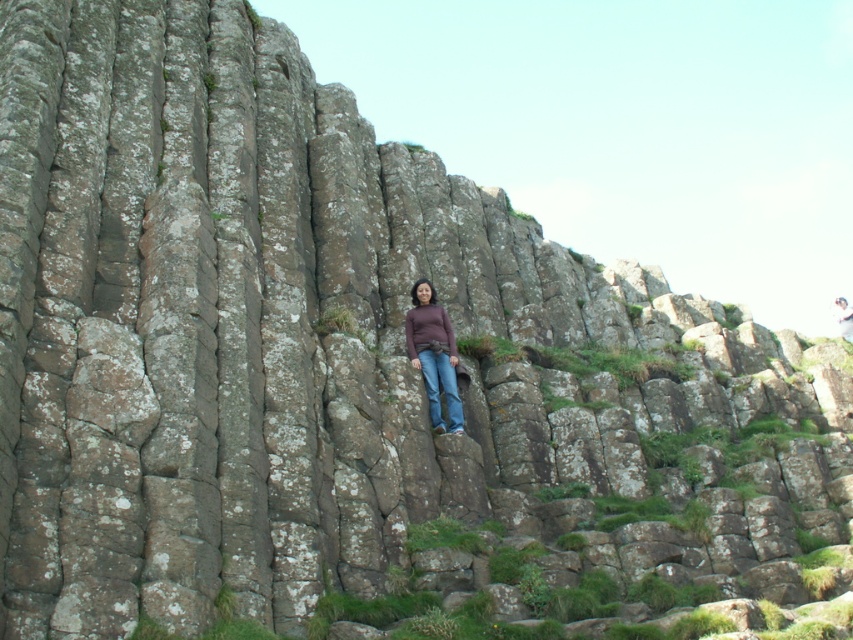
Question: Considering the relative positions of matte brown sweater at center and matte brown hair at center in the image provided, where is matte brown sweater at center located with respect to matte brown hair at center?

Choices:
 (A) left
 (B) right

Answer: (A)

Question: Which point is closer to the camera taking this photo?

Choices:
 (A) (850, 340)
 (B) (434, 339)

Answer: (B)

Question: Does matte brown sweater at center appear on the left side of matte brown hair at center?

Choices:
 (A) no
 (B) yes

Answer: (B)

Question: Among these objects, which one is nearest to the camera?

Choices:
 (A) matte brown hair at center
 (B) matte brown sweater at center

Answer: (B)

Question: Can you confirm if matte brown sweater at center is positioned above matte brown hair at center?

Choices:
 (A) yes
 (B) no

Answer: (B)